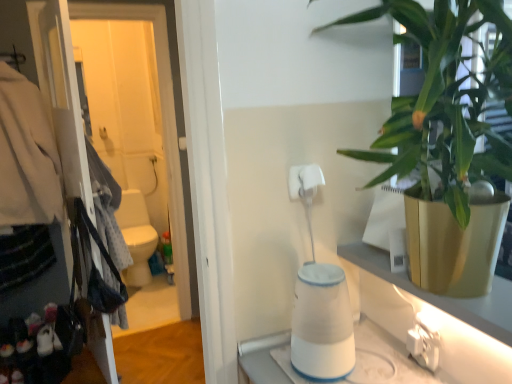
Identify the location of free space behind matte black coat hanger at left. This screenshot has width=512, height=384. (141, 341).